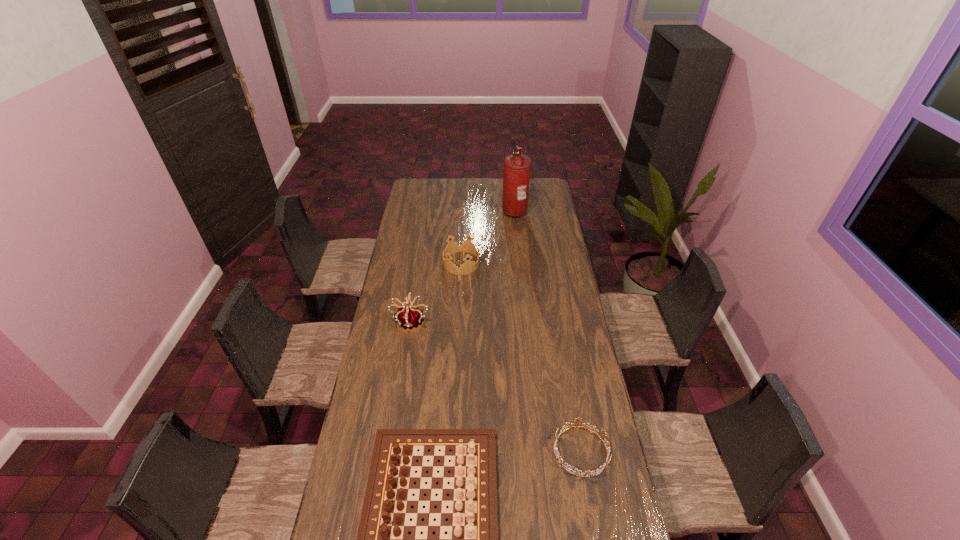
Locate an element on the screen. This screenshot has height=540, width=960. free space between the tallest object and the fourth nearest object is located at coordinates (488, 237).

The width and height of the screenshot is (960, 540). Identify the location of free space between the farthest tiara and the tallest tiara. (436, 292).

At what (x,y) coordinates should I click in order to perform the action: click on object that stands as the second closest to the nearest tiara. Please return your answer as a coordinate pair (x, y). The image size is (960, 540). Looking at the image, I should click on (410, 318).

Identify which object is located as the third nearest to the second tiara from right to left. Please provide its 2D coordinates. Your answer should be formatted as a tuple, i.e. [(x, y)], where the tuple contains the x and y coordinates of a point satisfying the conditions above.

[(472, 528)]

Select which tiara is the closest to the rightmost tiara. Please provide its 2D coordinates. Your answer should be formatted as a tuple, i.e. [(x, y)], where the tuple contains the x and y coordinates of a point satisfying the conditions above.

[(410, 318)]

You are a GUI agent. You are given a task and a screenshot of the screen. Output one action in this format:
    pyautogui.click(x=<x>, y=<y>)
    Task: Click on the tiara identified as the third closest to the fourth tallest object
    Image resolution: width=960 pixels, height=540 pixels.
    Given the screenshot: What is the action you would take?
    pyautogui.click(x=469, y=266)

The image size is (960, 540). What are the coordinates of `vacant region that satisfies the following two spatial constraints: 1. at the front of the fire extinguisher where the nozzle is aimed; 2. on the front-facing side of the third farthest object` in the screenshot? It's located at (526, 321).